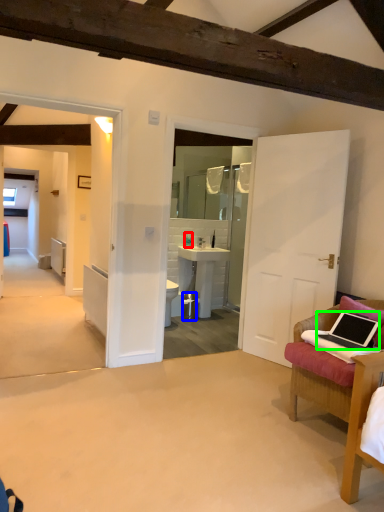
Question: Which is farther away from bottle (highlighted by a red box)? trash bin/can (highlighted by a blue box) or laptop (highlighted by a green box)?

Choices:
 (A) trash bin/can
 (B) laptop

Answer: (B)